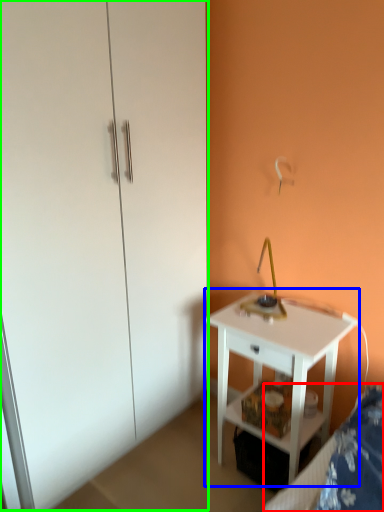
Question: Which object is the closest to the bed frame (highlighted by a red box)? Choose among these: nightstand (highlighted by a blue box) or dresser (highlighted by a green box).

Choices:
 (A) nightstand
 (B) dresser

Answer: (A)